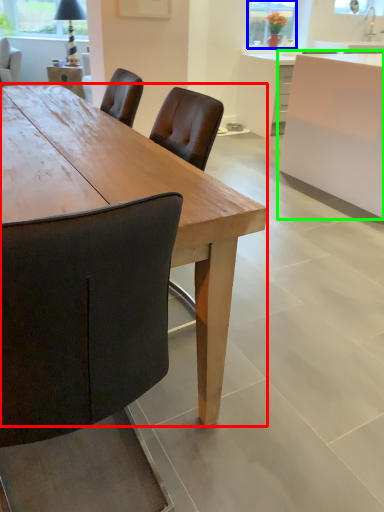
Question: Which is farther away from desk (highlighted by a red box)? window screen (highlighted by a blue box) or cabinetry (highlighted by a green box)?

Choices:
 (A) window screen
 (B) cabinetry

Answer: (A)